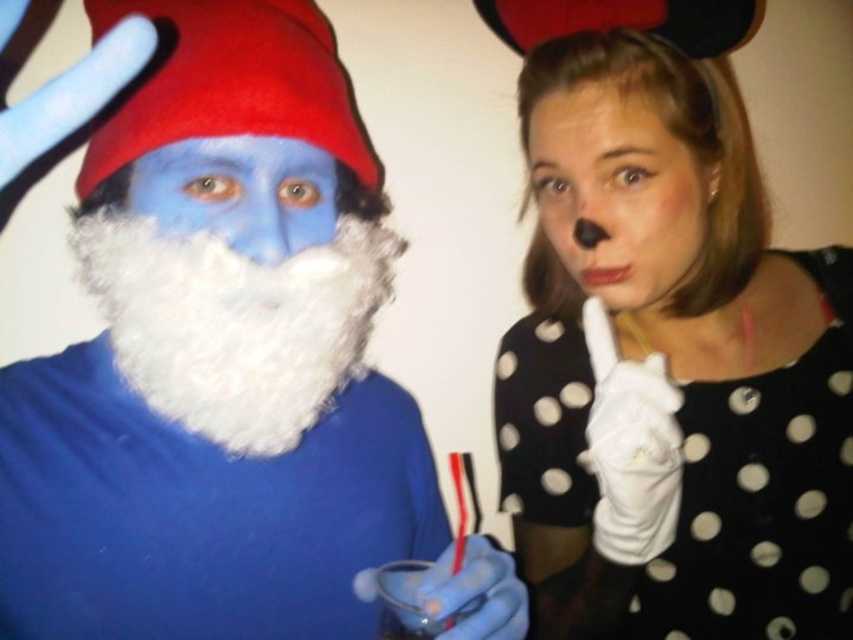
From the picture: Can you confirm if white fluffy beard at center is positioned below white polka dot dress at center?

No.

Who is positioned more to the right, white fluffy beard at center or white polka dot dress at center?

From the viewer's perspective, white polka dot dress at center appears more on the right side.

Which is behind, point (41, 550) or point (566, 116)?

The point (566, 116) is more distant.

Where is `white fluffy beard at center`? The width and height of the screenshot is (853, 640). white fluffy beard at center is located at coordinates (225, 364).

Is point (543, 412) more distant than point (251, 413)?

That is True.

The height and width of the screenshot is (640, 853). What do you see at coordinates (670, 365) in the screenshot?
I see `white polka dot dress at center` at bounding box center [670, 365].

Image resolution: width=853 pixels, height=640 pixels. Identify the location of white polka dot dress at center. (670, 365).

Between point (642, 189) and point (175, 209), which one is positioned in front?

Point (175, 209) is in front.

Can you confirm if matte black nose at center is thinner than blue matte face at left?

In fact, matte black nose at center might be wider than blue matte face at left.

Between point (540, 196) and point (316, 220), which one is positioned behind?

Point (540, 196)

Where is `matte black nose at center`? The height and width of the screenshot is (640, 853). matte black nose at center is located at coordinates (618, 193).